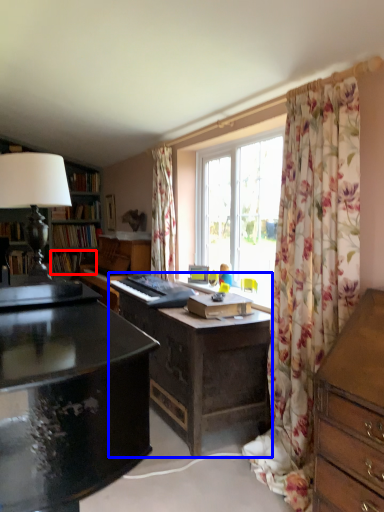
Question: Which point is closer to the camera, book (highlighted by a red box) or desk (highlighted by a blue box)?

Choices:
 (A) book
 (B) desk

Answer: (B)